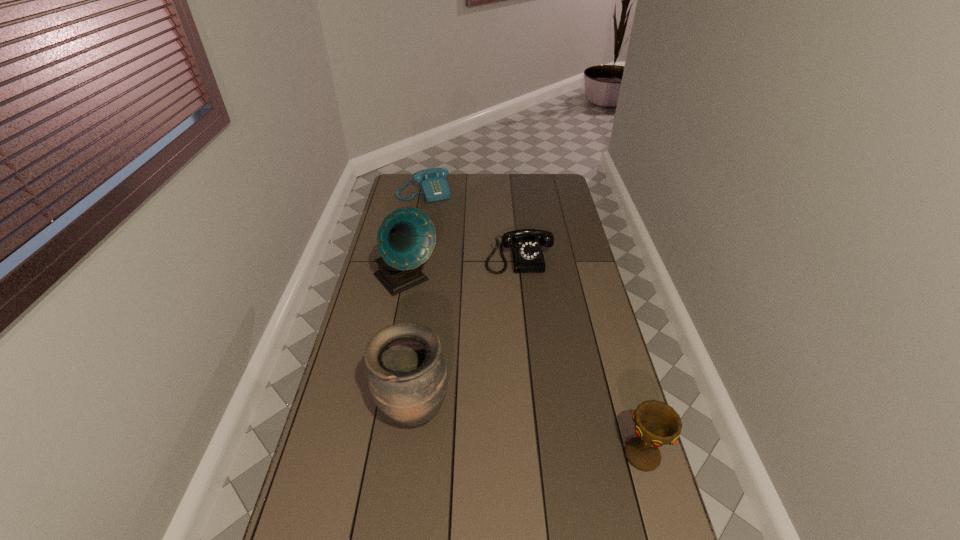
I want to click on vacant area located on the dial of the right telephone, so click(524, 290).

I want to click on vacant space located 0.220m on the dial of the right telephone, so click(528, 314).

Identify the location of vacant space situated 0.120m on the dial of the right telephone. [525, 295].

Locate an element on the screen. free point located on the dial of the left telephone is located at coordinates [x=453, y=244].

The image size is (960, 540). I want to click on blank space located 0.200m on the dial of the left telephone, so click(443, 224).

Find the location of a particular element. This screenshot has height=540, width=960. vacant space located on the dial of the left telephone is located at coordinates (444, 226).

Locate an element on the screen. This screenshot has width=960, height=540. vacant region located from the horn of the phonograph_record is located at coordinates (486, 367).

Find the location of a particular element. The image size is (960, 540). vacant space situated 0.140m from the horn of the phonograph_record is located at coordinates (444, 322).

The image size is (960, 540). I want to click on free space located 0.390m from the horn of the phonograph_record, so click(486, 367).

Find the location of a particular element. The image size is (960, 540). object that is at the far edge is located at coordinates (432, 182).